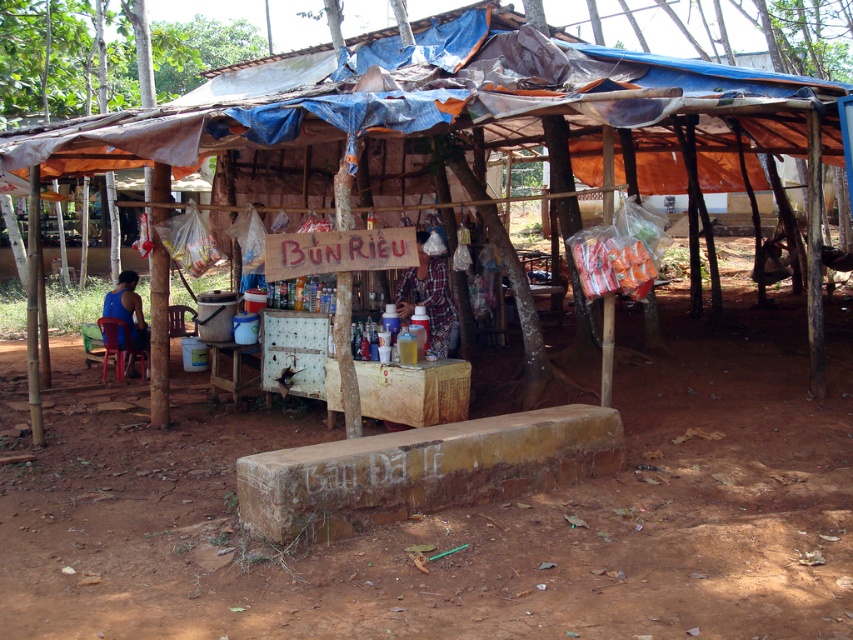
Question: Considering the real-world distances, which object is closest to the wooden shack at center?

Choices:
 (A) plaid fabric shirt at center
 (B) brown dirt field at center
 (C) blue fabric shirt at left

Answer: (A)

Question: Considering the real-world distances, which object is closest to the plaid fabric shirt at center?

Choices:
 (A) brown dirt field at center
 (B) blue fabric shirt at left
 (C) wooden shack at center

Answer: (C)

Question: Where is brown dirt field at center located in relation to blue fabric shirt at left in the image?

Choices:
 (A) below
 (B) above

Answer: (A)

Question: Is wooden shack at center closer to camera compared to plaid fabric shirt at center?

Choices:
 (A) no
 (B) yes

Answer: (B)

Question: Which object appears closest to the camera in this image?

Choices:
 (A) blue fabric shirt at left
 (B) wooden shack at center
 (C) plaid fabric shirt at center
 (D) brown dirt field at center

Answer: (D)

Question: In this image, where is brown dirt field at center located relative to plaid fabric shirt at center?

Choices:
 (A) above
 (B) below

Answer: (B)